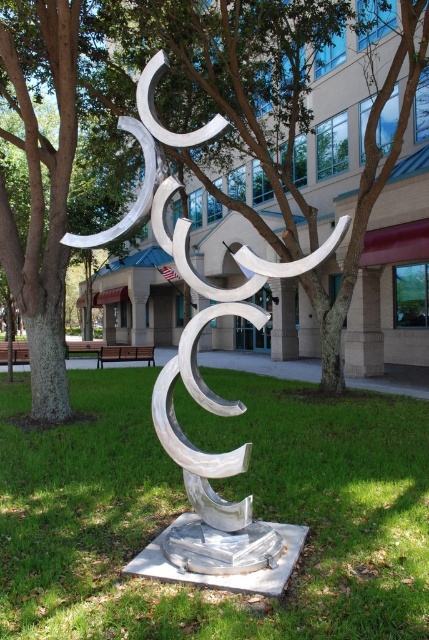
Question: Among these objects, which one is nearest to the camera?

Choices:
 (A) wooden park bench at center
 (B) green grass at center
 (C) wooden bench at center
 (D) green bark tree at center

Answer: (B)

Question: Which object is farther from the camera taking this photo?

Choices:
 (A) wooden bench at center
 (B) green bark tree at center
 (C) green grass at center

Answer: (A)

Question: Does polished silver sculpture at center appear on the right side of green bark tree at center?

Choices:
 (A) yes
 (B) no

Answer: (B)

Question: Which point is closer to the camera taking this photo?

Choices:
 (A) pos(85,355)
 (B) pos(148,364)

Answer: (B)

Question: Does polished silver sculpture at center have a lesser width compared to wooden park bench at center?

Choices:
 (A) yes
 (B) no

Answer: (A)

Question: Is the position of green grass at center less distant than that of polished silver sculpture at center?

Choices:
 (A) no
 (B) yes

Answer: (A)